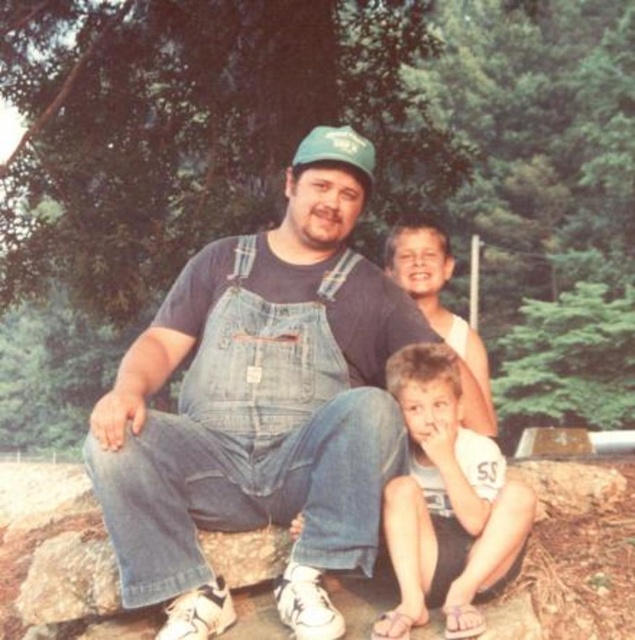
Which is in front, point (398, 310) or point (465, 636)?

Point (465, 636) is in front.

Is denim overalls at center thinner than light brown hair at lower center?

No.

Which is behind, point (293, 240) or point (502, 529)?

The point (293, 240) is more distant.

This screenshot has height=640, width=635. I want to click on denim overalls at center, so click(260, 406).

Who is higher up, denim overalls at center or smooth tan skin at upper center?

smooth tan skin at upper center is above.

Does denim overalls at center have a smaller size compared to smooth tan skin at upper center?

No, denim overalls at center is not smaller than smooth tan skin at upper center.

Between point (163, 445) and point (411, 253), which one is positioned in front?

Point (163, 445)

Locate an element on the screen. denim overalls at center is located at coordinates (260, 406).

How distant is light brown hair at lower center from smooth tan skin at upper center?

A distance of 27.76 inches exists between light brown hair at lower center and smooth tan skin at upper center.

Does light brown hair at lower center appear on the right side of smooth tan skin at upper center?

In fact, light brown hair at lower center is to the left of smooth tan skin at upper center.

Image resolution: width=635 pixels, height=640 pixels. Identify the location of light brown hair at lower center. (446, 502).